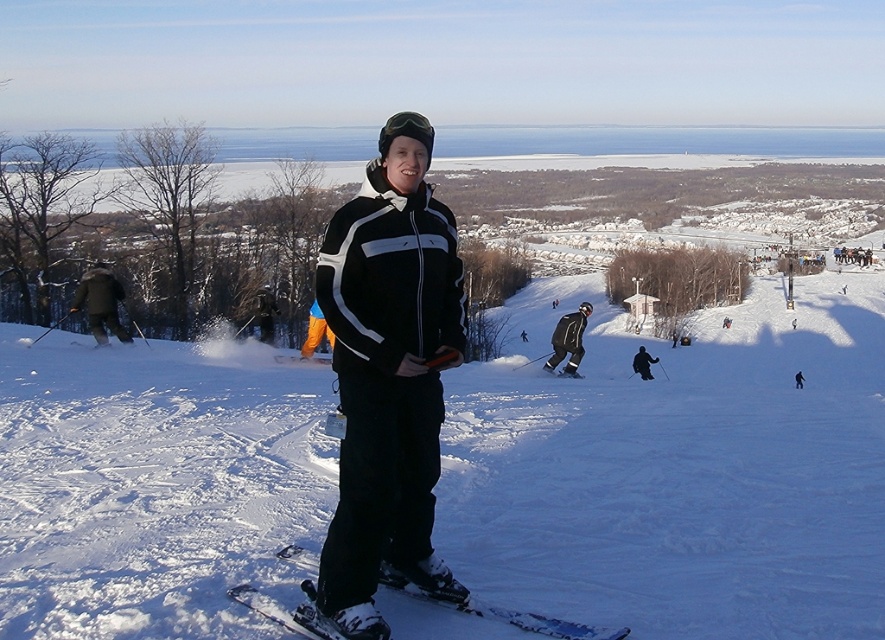
Is white plastic ski at center wider than black matte ski suit at center?

In fact, white plastic ski at center might be narrower than black matte ski suit at center.

Is point (471, 604) behind point (575, 320)?

No, (471, 604) is in front of (575, 320).

Image resolution: width=885 pixels, height=640 pixels. In order to click on white plastic ski at center in this screenshot , I will do `click(503, 612)`.

Is point (373, 205) closer to viewer compared to point (566, 320)?

Yes, it is in front of point (566, 320).

This screenshot has width=885, height=640. What do you see at coordinates (389, 376) in the screenshot?
I see `black matte jacket at center` at bounding box center [389, 376].

Find the location of `black matte jacket at center`. black matte jacket at center is located at coordinates (389, 376).

Does black matte jacket at center appear over white plastic ski at center?

Indeed, black matte jacket at center is positioned over white plastic ski at center.

Is black matte jacket at center positioned before white plastic ski at center?

That is True.

Find the location of `black matte jacket at center`. black matte jacket at center is located at coordinates (389, 376).